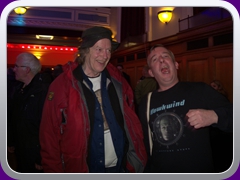
Identify the location of red lights. The image size is (240, 180). (48, 48), (64, 48), (72, 49), (21, 45).